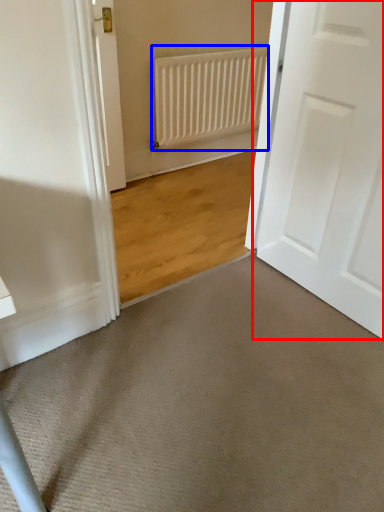
Question: Which object appears closest to the camera in this image, door (highlighted by a red box) or radiator (highlighted by a blue box)?

Choices:
 (A) door
 (B) radiator

Answer: (A)